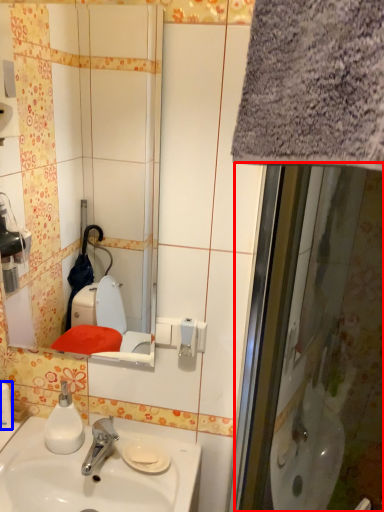
Question: Which of the following is the closest to the observer, screen door (highlighted by a red box) or toiletry (highlighted by a blue box)?

Choices:
 (A) screen door
 (B) toiletry

Answer: (A)